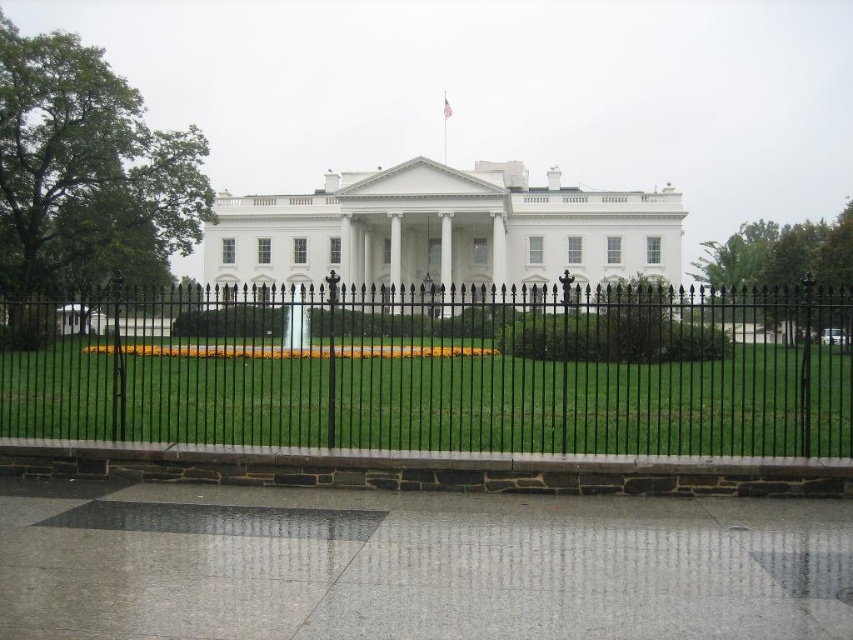
Question: Is black wrought iron fence at center to the right of gray polished concrete at lower center from the viewer's perspective?

Choices:
 (A) yes
 (B) no

Answer: (B)

Question: Which point appears farthest from the camera in this image?

Choices:
 (A) (68, 561)
 (B) (824, 337)

Answer: (B)

Question: From the image, what is the correct spatial relationship of black wrought iron fence at center in relation to gray polished concrete at lower center?

Choices:
 (A) below
 (B) above

Answer: (B)

Question: Can you confirm if black wrought iron fence at center is thinner than gray polished concrete at lower center?

Choices:
 (A) no
 (B) yes

Answer: (A)